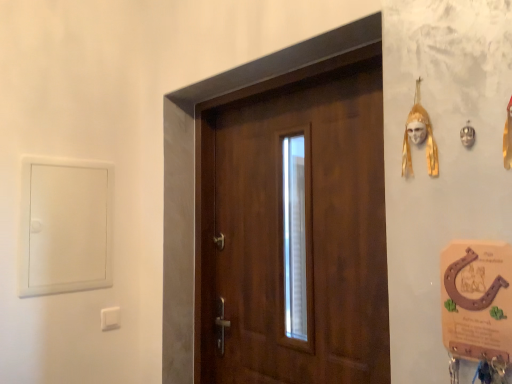
Question: From a real-world perspective, is gold metallic mask at upper right located beneath white plastic light switch at lower left?

Choices:
 (A) no
 (B) yes

Answer: (A)

Question: Does gold metallic mask at upper right have a lesser width compared to white plastic light switch at lower left?

Choices:
 (A) no
 (B) yes

Answer: (A)

Question: Is white plastic light switch at lower left inside gold metallic mask at upper right?

Choices:
 (A) yes
 (B) no

Answer: (B)

Question: Can you confirm if gold metallic mask at upper right is wider than white plastic light switch at lower left?

Choices:
 (A) yes
 (B) no

Answer: (A)

Question: Is gold metallic mask at upper right bigger than white plastic light switch at lower left?

Choices:
 (A) no
 (B) yes

Answer: (B)

Question: Is gold metallic mask at upper right touching white plastic light switch at lower left?

Choices:
 (A) yes
 (B) no

Answer: (B)

Question: Is white plastic light switch at lower left far from wooden door at center?

Choices:
 (A) no
 (B) yes

Answer: (A)

Question: Does white plastic light switch at lower left lie in front of wooden door at center?

Choices:
 (A) yes
 (B) no

Answer: (B)

Question: From the image's perspective, is white plastic light switch at lower left under wooden door at center?

Choices:
 (A) yes
 (B) no

Answer: (A)

Question: Does white plastic light switch at lower left have a greater height compared to wooden door at center?

Choices:
 (A) yes
 (B) no

Answer: (B)

Question: Is white plastic light switch at lower left to the right of wooden door at center from the viewer's perspective?

Choices:
 (A) no
 (B) yes

Answer: (A)

Question: Considering the relative sizes of white plastic light switch at lower left and wooden door at center in the image provided, is white plastic light switch at lower left wider than wooden door at center?

Choices:
 (A) yes
 (B) no

Answer: (B)

Question: Does white plastic light switch at lower left turn towards gold metallic mask at upper right?

Choices:
 (A) no
 (B) yes

Answer: (A)